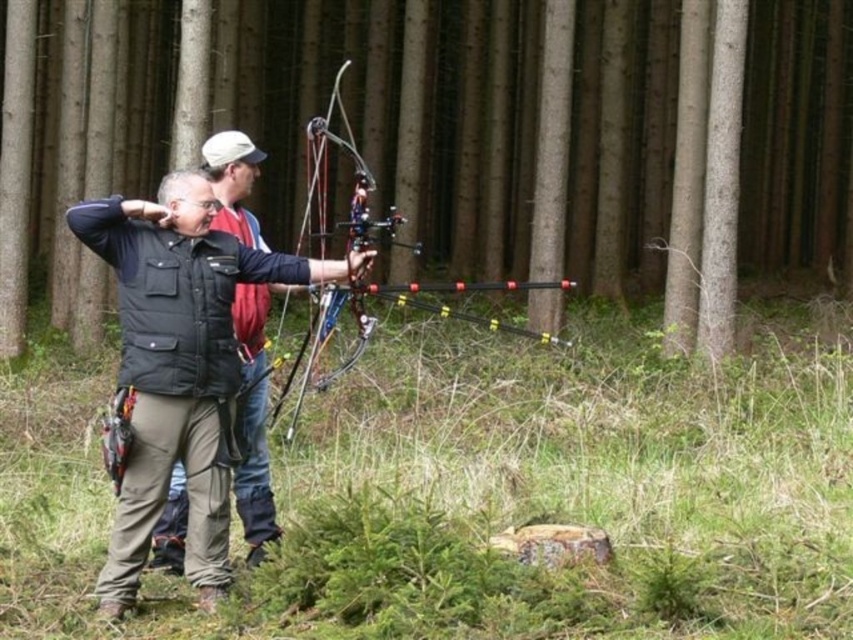
Is metallic black bow at center taller than black matte vest at center?

Yes, metallic black bow at center is taller than black matte vest at center.

Is point (483, 317) more distant than point (265, 461)?

Yes, point (483, 317) is farther from viewer.

At what (x,y) coordinates should I click in order to perform the action: click on metallic black bow at center. Please return your answer as a coordinate pair (x, y). Looking at the image, I should click on (375, 324).

Is point (102, 253) behind point (331, 308)?

No, it is not.

Which is more to the left, matte black jacket at center or metallic black bow at center?

matte black jacket at center

Who is more distant from viewer, (146, 531) or (393, 221)?

Point (393, 221)

The image size is (853, 640). I want to click on matte black jacket at center, so click(x=178, y=365).

Is matte black jacket at center bigger than black matte vest at center?

Correct, matte black jacket at center is larger in size than black matte vest at center.

Can you confirm if matte black jacket at center is shorter than black matte vest at center?

Correct, matte black jacket at center is not as tall as black matte vest at center.

Who is more forward, (120, 364) or (263, 244)?

Point (120, 364)

Where is `matte black jacket at center`? This screenshot has width=853, height=640. matte black jacket at center is located at coordinates (178, 365).